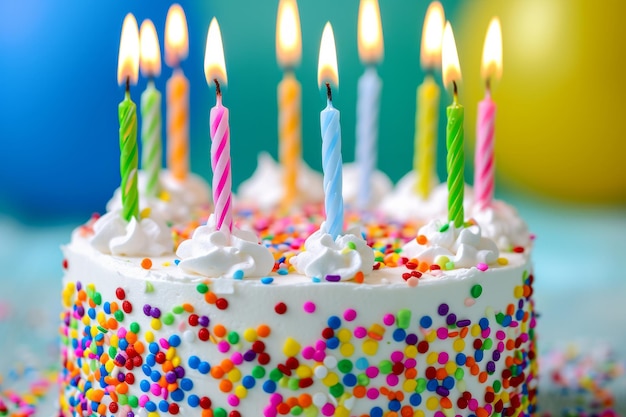
In order to click on candles in this screenshot , I will do `click(126, 139)`, `click(153, 127)`, `click(178, 126)`, `click(216, 135)`, `click(294, 123)`, `click(336, 141)`, `click(372, 120)`, `click(429, 120)`, `click(456, 138)`, `click(483, 141)`.